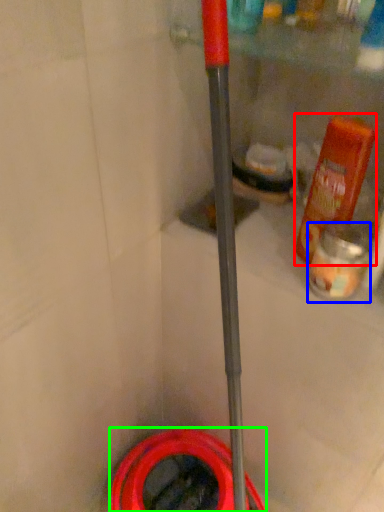
Question: Based on their relative distances, which object is farther from bottle (highlighted by a red box)? Choose from cleaning product (highlighted by a blue box) and garden hose (highlighted by a green box).

Choices:
 (A) cleaning product
 (B) garden hose

Answer: (B)